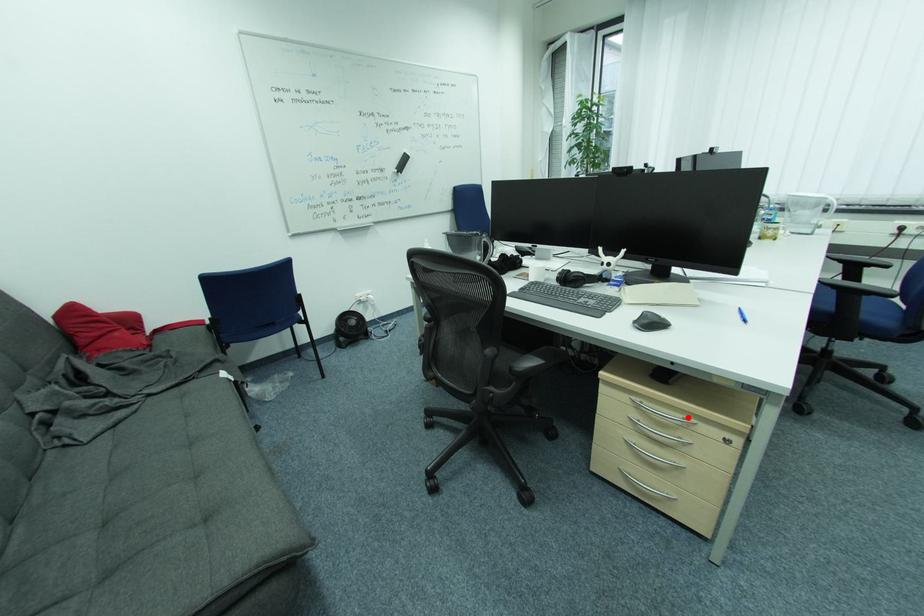
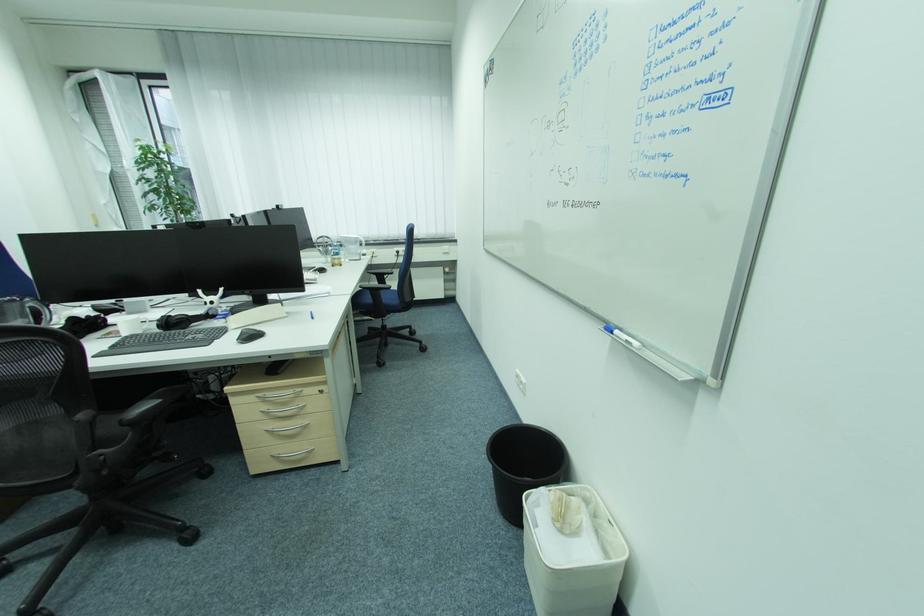
Find the pixel in the second image that matches the highlighted location in the first image.

(299, 392)